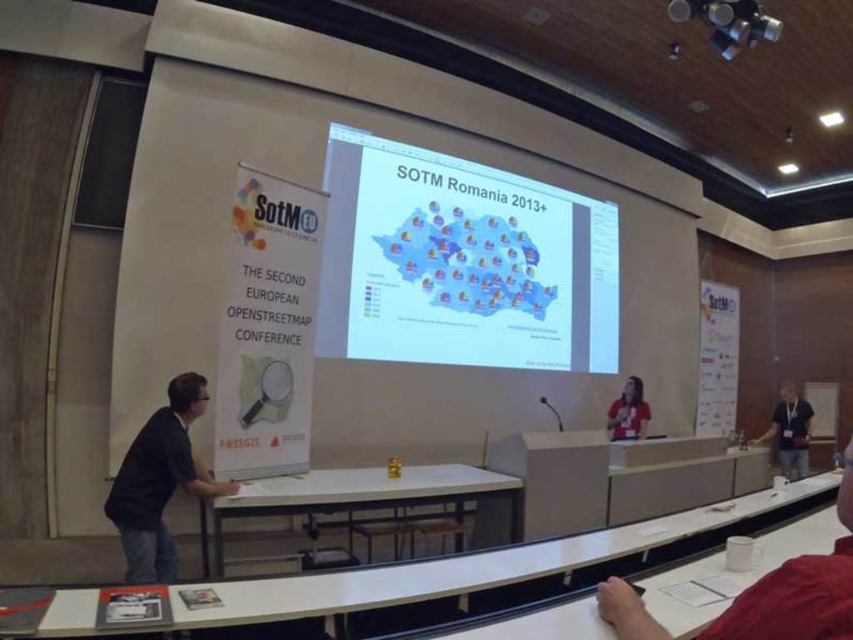
Question: Is white glossy table at lower center positioned before light blue shirt at right?

Choices:
 (A) no
 (B) yes

Answer: (B)

Question: Which point is farther from the camera taking this photo?

Choices:
 (A) (782, 397)
 (B) (801, 490)

Answer: (A)

Question: Estimate the real-world distances between objects in this image. Which object is farther from the light blue shirt at right?

Choices:
 (A) metallic projector at upper center
 (B) matte red shirt at center

Answer: (A)

Question: From the image, what is the correct spatial relationship of black shirt at left in relation to light blue shirt at right?

Choices:
 (A) below
 (B) above

Answer: (B)

Question: Can you confirm if white matte map at center is positioned below white glossy table at lower center?

Choices:
 (A) yes
 (B) no

Answer: (B)

Question: Which object is the closest to the light blue shirt at right?

Choices:
 (A) metallic projector at upper center
 (B) white glossy table at lower center
 (C) white matte map at center

Answer: (C)